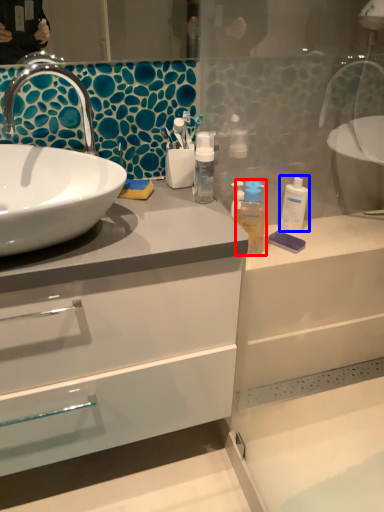
Question: Which point is closer to the camera, mouthwash (highlighted by a red box) or mouthwash (highlighted by a blue box)?

Choices:
 (A) mouthwash
 (B) mouthwash

Answer: (A)